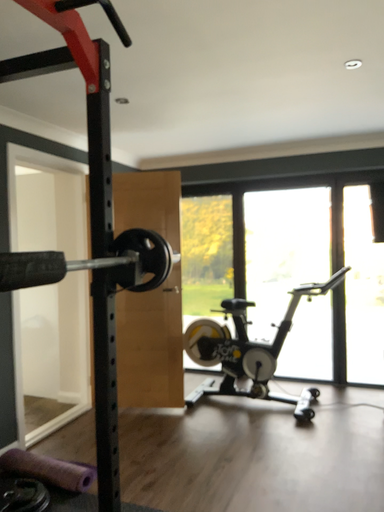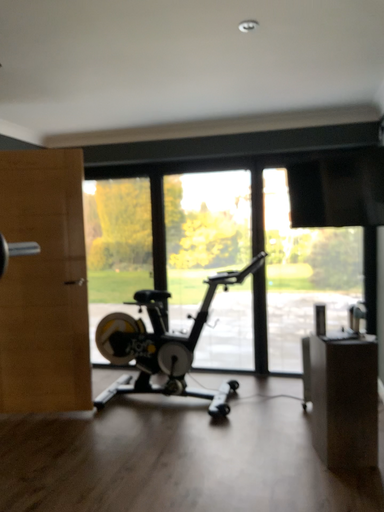
Question: How did the camera likely rotate when shooting the video?

Choices:
 (A) rotated right
 (B) rotated left

Answer: (A)